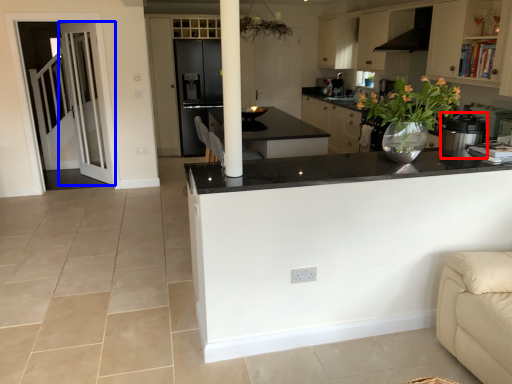
Question: Which object is closer to the camera taking this photo, kitchen appliance (highlighted by a red box) or door (highlighted by a blue box)?

Choices:
 (A) kitchen appliance
 (B) door

Answer: (A)